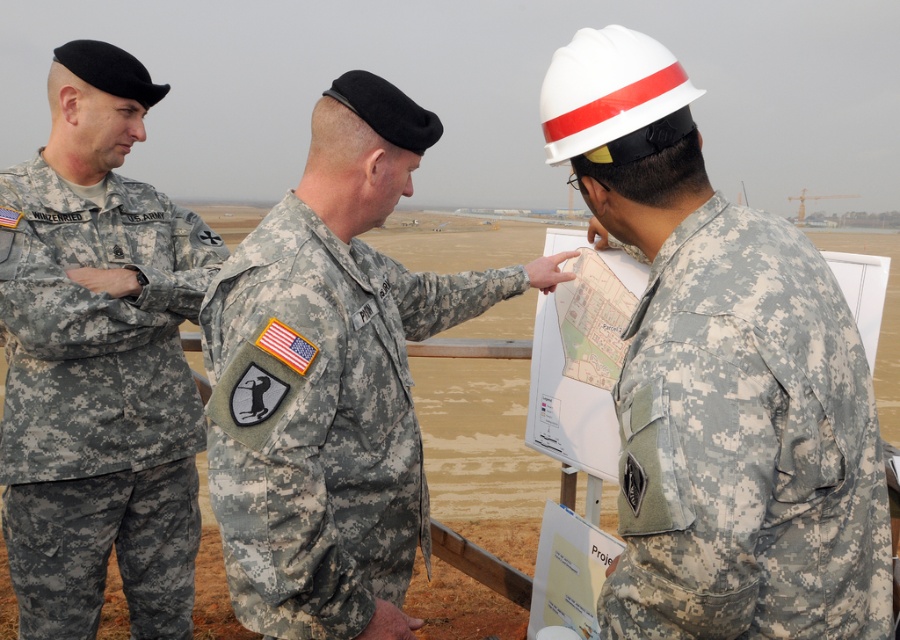
Where is the camouflage fabric uniform at center located in the image?

The camouflage fabric uniform at center is located at point 0.656 on the x axis and 0.358 on the y axis.